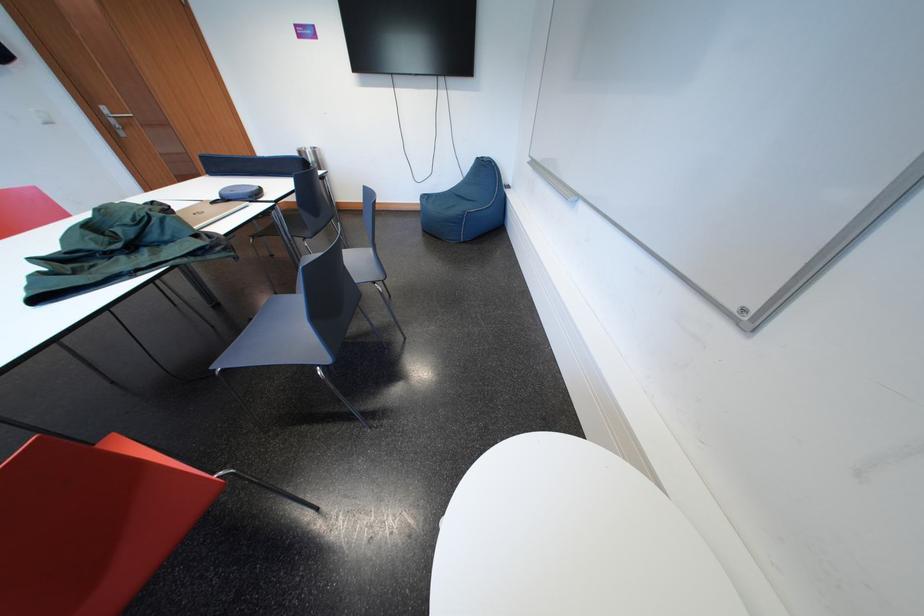
Locate an element on the screen. Image resolution: width=924 pixels, height=616 pixels. grey zippered pouch is located at coordinates (466, 205).